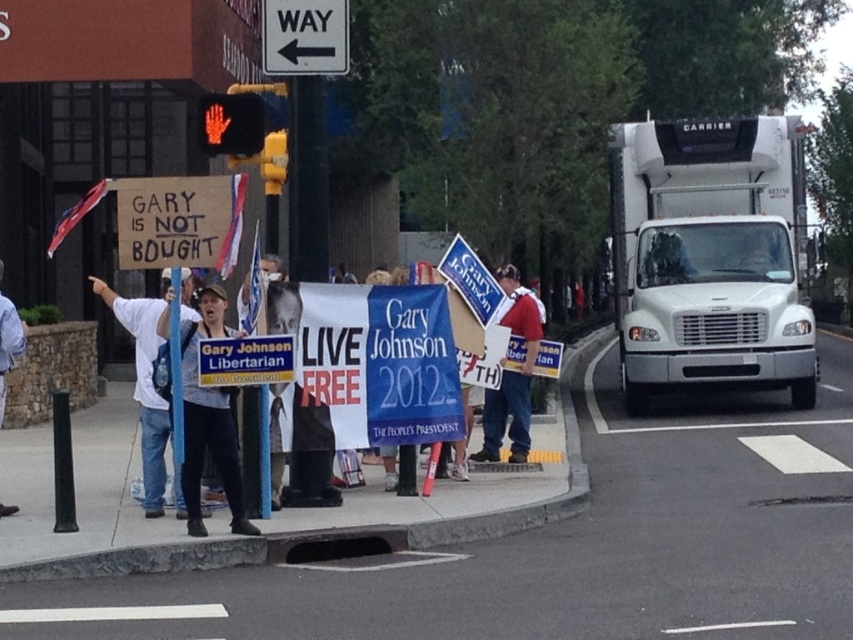
You are a pedestrian standing at the crosswalk near the traffic light. You need to reach the white metallic truck at right. Which direction should you walk to get there from your current position?

The white metallic truck at right is located at point (x=711, y=259), so you should walk towards the right side of the scene to reach it.

You are a pedestrian crossing the street and see the white metallic truck at right and the cardboard sign at center. Which object is closer to the ground?

The white metallic truck at right is located below the cardboard sign at center, so it is closer to the ground.

You are a delivery driver who needs to pass through the area where the cardboard sign at center and the red led hand at upper left are located. The minimum safe distance required between your truck and any obstacles is 4 feet. Can you safely navigate through this area without stopping?

The distance between the cardboard sign at center and the red led hand at upper left is 3.78 feet, which is less than the required 4 feet safe distance. Therefore, you cannot safely navigate through this area without stopping.